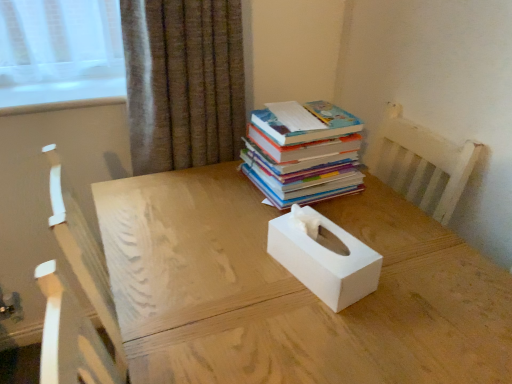
Locate an element on the screen. Image resolution: width=512 pixels, height=384 pixels. free space to the left of hardcover books at upper right is located at coordinates (206, 188).